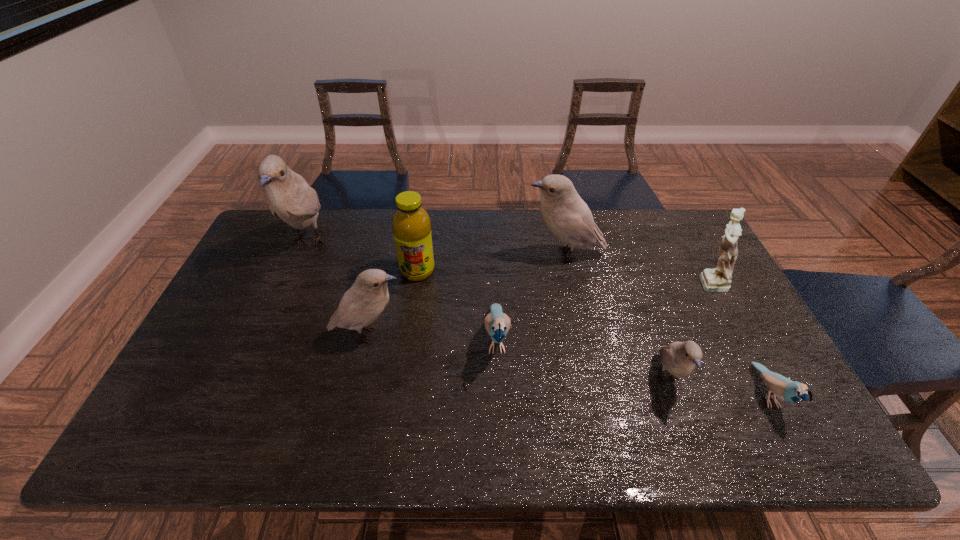
The image size is (960, 540). In order to click on vacant point located between the figurine and the fifth bird from left to right in this screenshot , I will do `click(688, 330)`.

Where is `empty space that is in between the left blue bird and the rightmost bird`? empty space that is in between the left blue bird and the rightmost bird is located at coordinates (632, 367).

Locate an element on the screen. free space between the tallest object and the shortest bird is located at coordinates (538, 318).

Identify the location of vacant space that is in between the fifth bird from right to left and the figurine. (539, 308).

Find the location of `blank region between the fruit juice and the leftmost object`. blank region between the fruit juice and the leftmost object is located at coordinates (363, 256).

You are a GUI agent. You are given a task and a screenshot of the screen. Output one action in this format:
    pyautogui.click(x=<x>, y=<y>)
    Task: Click on the vacant space that's between the fruit juice and the rightmost bird
    This screenshot has height=540, width=960.
    Given the screenshot: What is the action you would take?
    pyautogui.click(x=592, y=333)

The height and width of the screenshot is (540, 960). I want to click on free space that is in between the figurine and the fourth object from right to left, so click(x=636, y=268).

Where is `the sixth closest object to the fruit juice`? the sixth closest object to the fruit juice is located at coordinates (718, 279).

Where is `object that ranks as the fourth closest to the leftmost bird`? This screenshot has height=540, width=960. object that ranks as the fourth closest to the leftmost bird is located at coordinates (568, 217).

Where is `bird that can be found as the closest to the rightmost white bird`? bird that can be found as the closest to the rightmost white bird is located at coordinates (790, 391).